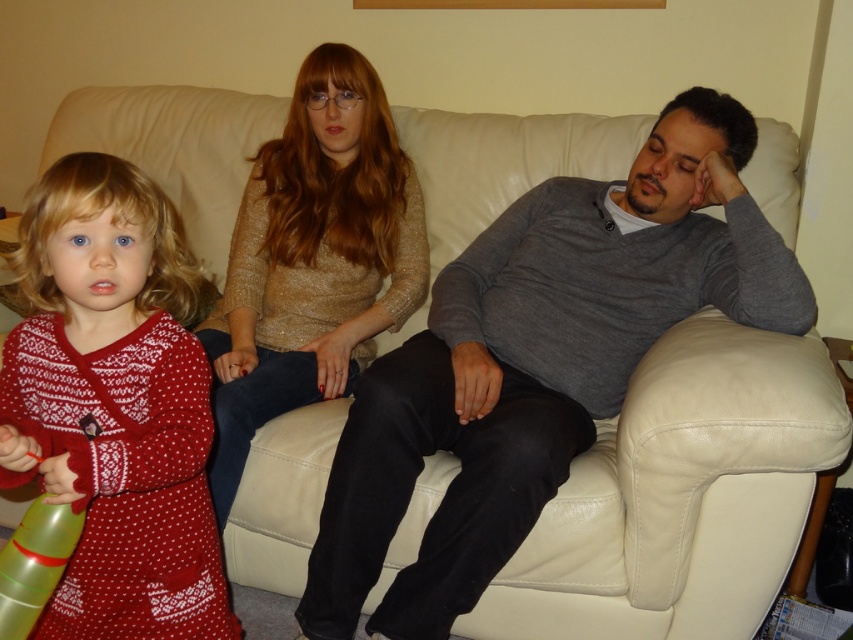
Who is more distant from viewer, (415, 429) or (229, 305)?

The point (229, 305) is behind.

Which is in front, point (343, 452) or point (248, 268)?

Point (343, 452)

What do you see at coordinates (538, 362) in the screenshot? The width and height of the screenshot is (853, 640). I see `gray matte sweater at center` at bounding box center [538, 362].

The width and height of the screenshot is (853, 640). In order to click on gray matte sweater at center in this screenshot , I will do `click(538, 362)`.

Between red knit dress at left and shiny gold sweater at center, which one is positioned lower?

red knit dress at left

Between red knit dress at left and shiny gold sweater at center, which one has less height?

Standing shorter between the two is red knit dress at left.

Find the location of a particular element. The width and height of the screenshot is (853, 640). red knit dress at left is located at coordinates (114, 404).

Does gray matte sweater at center have a larger size compared to red knit dress at left?

Yes.

Can you confirm if gray matte sweater at center is positioned to the right of red knit dress at left?

Indeed, gray matte sweater at center is positioned on the right side of red knit dress at left.

Is point (733, 307) farther from viewer compared to point (103, 336)?

That is True.

Where is `gray matte sweater at center`? gray matte sweater at center is located at coordinates (538, 362).